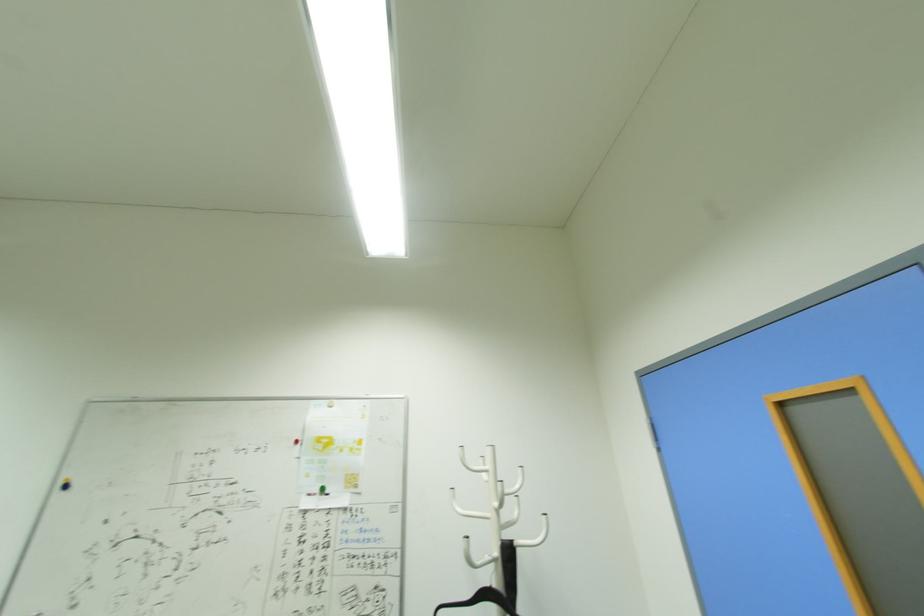
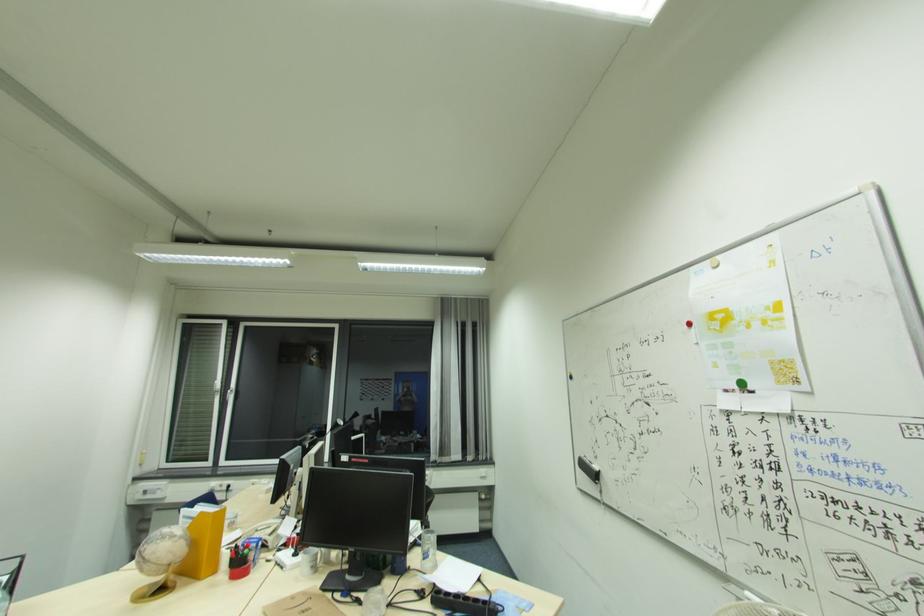
Find the pixel in the second image that matches [322,492] in the first image.

(739, 387)